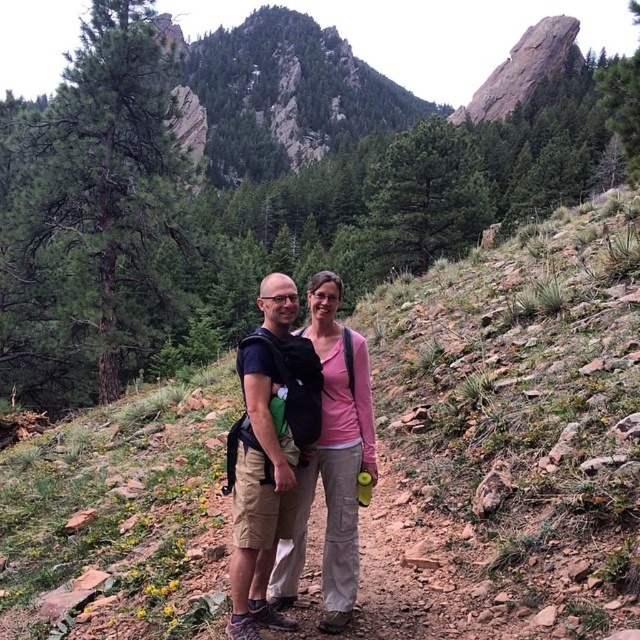
Question: Does green grassy hillside at center lie behind matte black backpack at center?

Choices:
 (A) yes
 (B) no

Answer: (B)

Question: Which object is farther from the camera taking this photo?

Choices:
 (A) green grassy hillside at center
 (B) matte black backpack at center

Answer: (B)

Question: From the image, what is the correct spatial relationship of green grassy hillside at center in relation to matte black backpack at center?

Choices:
 (A) right
 (B) left

Answer: (A)

Question: Does green grassy hillside at center come behind matte black backpack at center?

Choices:
 (A) no
 (B) yes

Answer: (A)

Question: Which point appears closest to the camera in this image?

Choices:
 (A) (115, 547)
 (B) (330, 397)

Answer: (B)